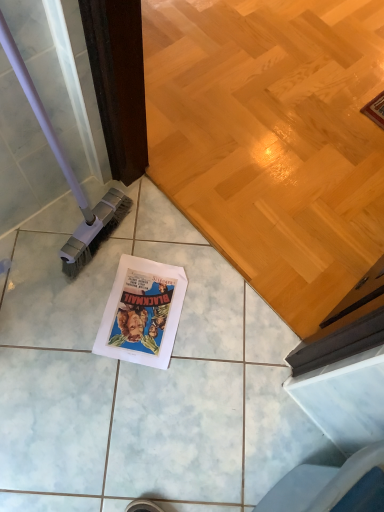
Where is `vacant area that is in front of white paper comic book at center`? vacant area that is in front of white paper comic book at center is located at coordinates (127, 398).